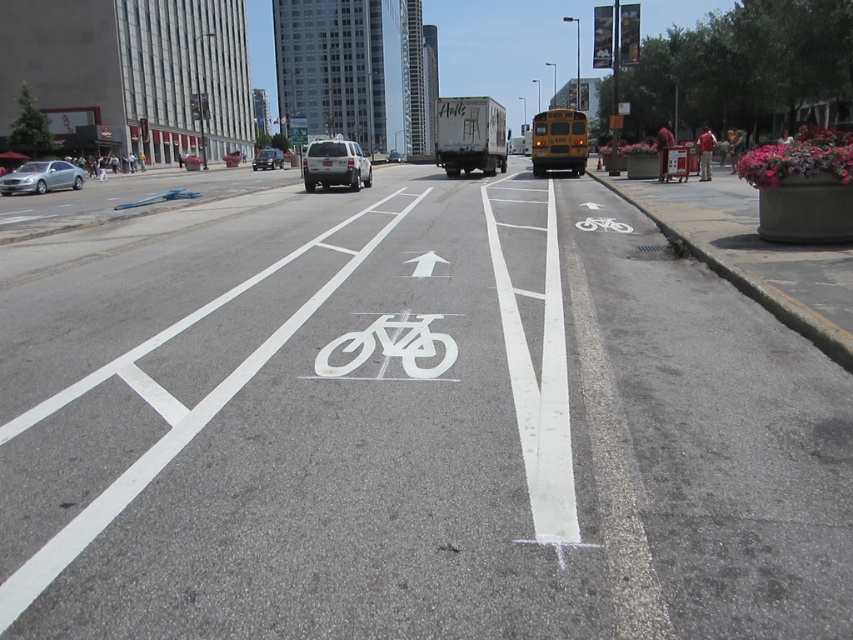
Question: Is yellow matte school bus at center wider than silver metallic suv at center?

Choices:
 (A) no
 (B) yes

Answer: (B)

Question: Among these objects, which one is nearest to the camera?

Choices:
 (A) silver metallic sedan at left
 (B) metallic silver sedan at center
 (C) silver metallic suv at center
 (D) yellow matte school bus at center

Answer: (A)

Question: Which point appears closest to the camera in this image?

Choices:
 (A) (189, 161)
 (B) (329, 147)

Answer: (B)

Question: Is yellow matte school bus at center positioned behind metallic silver sedan at center?

Choices:
 (A) no
 (B) yes

Answer: (A)

Question: Which object is the closest to the silver metallic truck at center?

Choices:
 (A) yellow matte school bus at center
 (B) silver metallic suv at center
 (C) silver metallic sedan at left

Answer: (C)

Question: Does silver metallic sedan at left appear over metallic silver sedan at center?

Choices:
 (A) yes
 (B) no

Answer: (B)